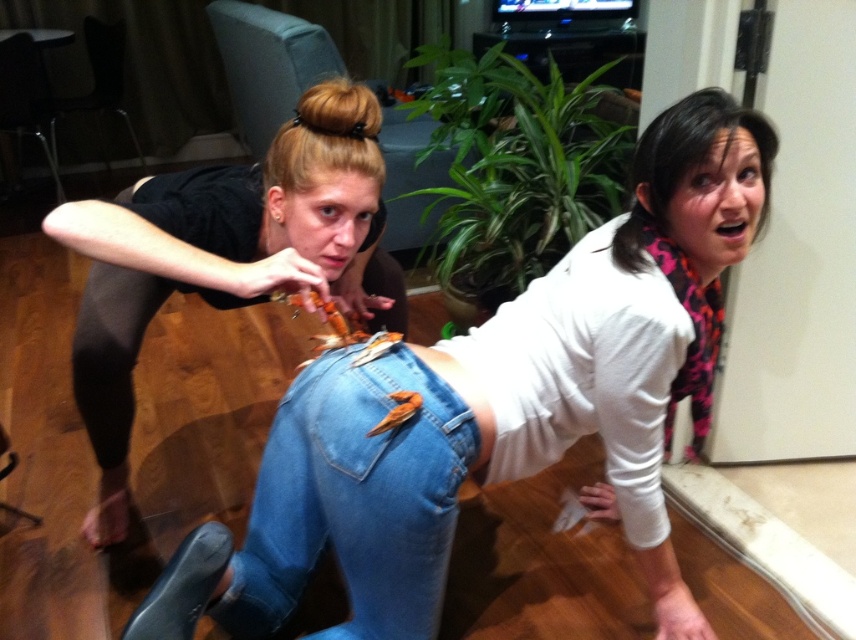
Who is taller, denim jeans at lower center or denim at lower center?

Standing taller between the two is denim jeans at lower center.

Is point (706, 148) behind point (331, 392)?

That is False.

Is point (684, 321) more distant than point (266, 506)?

No, (684, 321) is closer to viewer.

This screenshot has height=640, width=856. In order to click on denim jeans at lower center in this screenshot , I will do `click(498, 410)`.